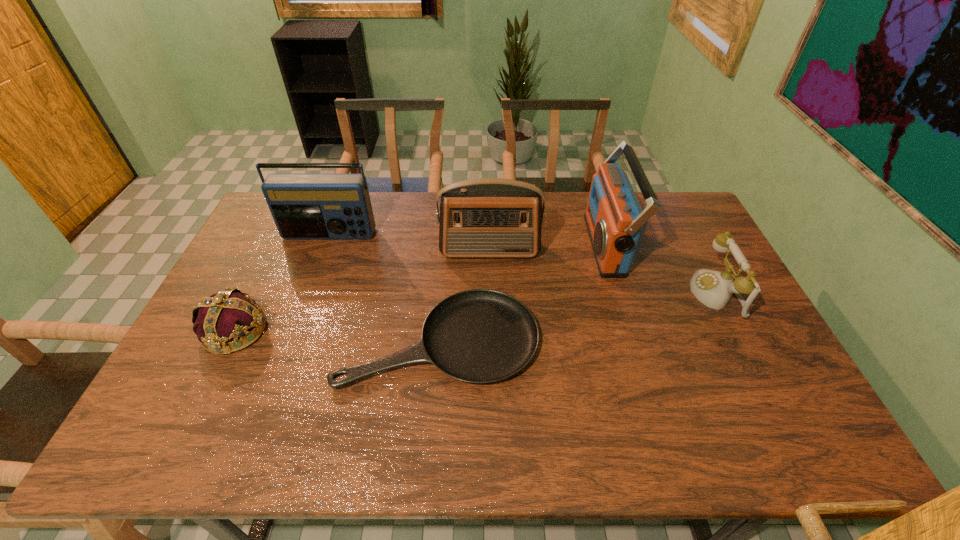
At what (x,y) coordinates should I click in order to perform the action: click on vacant space at the far edge. Please return your answer as a coordinate pair (x, y). The image size is (960, 540). Looking at the image, I should click on (412, 194).

Locate an element on the screen. The height and width of the screenshot is (540, 960). free space at the left edge is located at coordinates (209, 397).

Identify the location of vacant space at the right edge of the desktop. This screenshot has width=960, height=540. (796, 407).

This screenshot has width=960, height=540. Find the location of `blank space at the far right corner of the desktop`. blank space at the far right corner of the desktop is located at coordinates (688, 204).

Where is `empty space between the crown and the shortest object`? The image size is (960, 540). empty space between the crown and the shortest object is located at coordinates (338, 335).

Locate an element on the screen. This screenshot has width=960, height=540. blank region between the second radio receiver from left to right and the crown is located at coordinates [363, 291].

This screenshot has width=960, height=540. What are the coordinates of `empty space between the telephone and the rightmost radio receiver` in the screenshot? It's located at (660, 269).

Find the location of a particular element. The height and width of the screenshot is (540, 960). vacant point located between the frying pan and the leftmost radio receiver is located at coordinates (384, 287).

Identify the location of blank region between the second radio receiver from left to right and the crown. (363, 291).

At what (x,y) coordinates should I click in order to perform the action: click on unoccupied area between the leftmost radio receiver and the second radio receiver from left to right. Please return your answer as a coordinate pair (x, y). The width and height of the screenshot is (960, 540). Looking at the image, I should click on (409, 243).